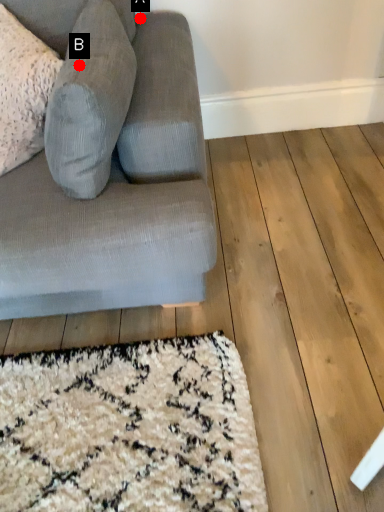
Question: Two points are circled on the image, labeled by A and B beside each circle. Among these points, which one is nearest to the camera?

Choices:
 (A) A is closer
 (B) B is closer

Answer: (B)